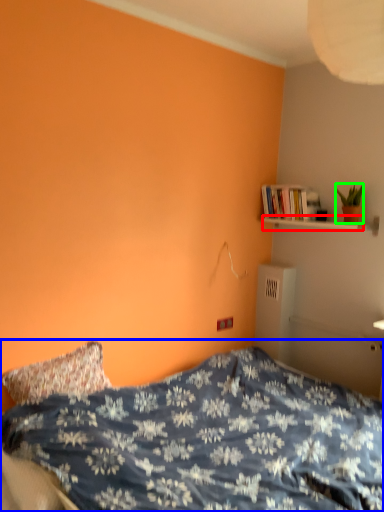
Question: Considering the real-world distances, which object is closest to shelf (highlighted by a red box)? bed (highlighted by a blue box) or houseplant (highlighted by a green box).

Choices:
 (A) bed
 (B) houseplant

Answer: (B)